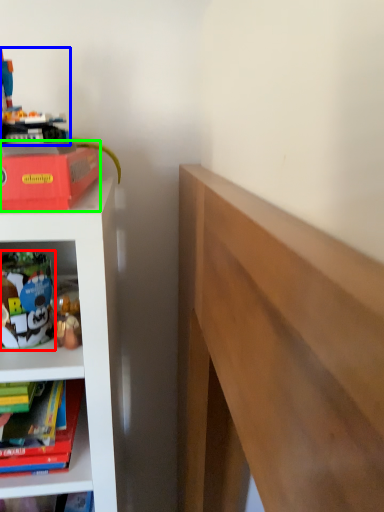
Question: Considering the real-world distances, which object is closest to toy (highlighted by a red box)? toy (highlighted by a blue box) or paperback book (highlighted by a green box).

Choices:
 (A) toy
 (B) paperback book

Answer: (B)